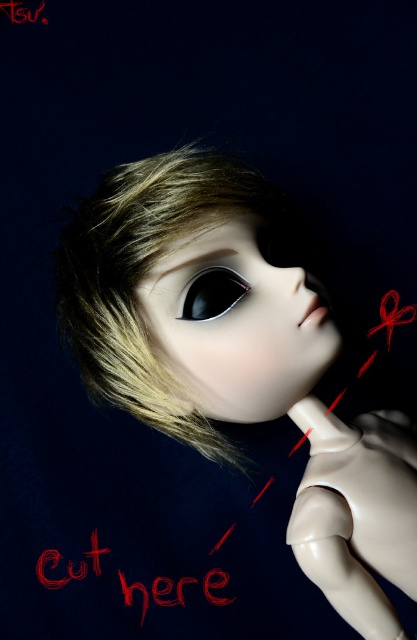
Question: Which point is farther to the camera?

Choices:
 (A) (92, 538)
 (B) (221, 284)
 (C) (188, 298)
 (D) (231, 410)

Answer: (A)

Question: Is matte plastic doll at center wider than brushed metal text at center?

Choices:
 (A) no
 (B) yes

Answer: (B)

Question: Which of the following is the closest to the observer?

Choices:
 (A) smooth porcelain face at center
 (B) brushed metal text at center
 (C) black glossy eye at center
 (D) matte plastic doll at center

Answer: (D)

Question: Can you confirm if matte plastic doll at center is positioned below brushed metal text at center?

Choices:
 (A) no
 (B) yes

Answer: (A)

Question: Which point is closer to the camera?

Choices:
 (A) (195, 305)
 (B) (208, 248)

Answer: (A)

Question: Is the position of smooth porcelain face at center more distant than that of black glossy eye at center?

Choices:
 (A) yes
 (B) no

Answer: (B)